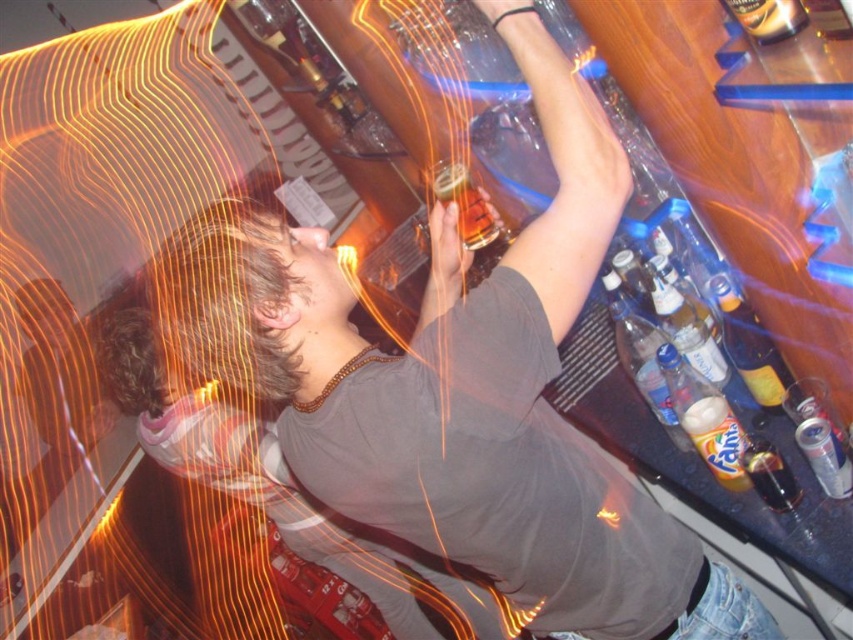
Can you confirm if clear glass bottle at center is positioned below gold metallic beer can at upper right?

Correct, clear glass bottle at center is located below gold metallic beer can at upper right.

Is clear glass bottle at center thinner than gold metallic beer can at upper right?

In fact, clear glass bottle at center might be wider than gold metallic beer can at upper right.

Looking at this image, measure the distance between clear glass bottle at center and camera.

clear glass bottle at center is 1.49 meters away from camera.

Locate an element on the screen. Image resolution: width=853 pixels, height=640 pixels. clear glass bottle at center is located at coordinates (685, 326).

Can you confirm if translucent plastic soda can at upper right is positioned to the right of gold metallic beer can at upper right?

Yes, translucent plastic soda can at upper right is to the right of gold metallic beer can at upper right.

Is translucent plastic soda can at upper right wider than gold metallic beer can at upper right?

Correct, the width of translucent plastic soda can at upper right exceeds that of gold metallic beer can at upper right.

Image resolution: width=853 pixels, height=640 pixels. Describe the element at coordinates (769, 474) in the screenshot. I see `translucent plastic soda can at upper right` at that location.

I want to click on translucent plastic soda can at upper right, so click(x=769, y=474).

Can you confirm if translucent amber glass at upper center is bigger than translucent plastic soda can at upper right?

Yes, translucent amber glass at upper center is bigger than translucent plastic soda can at upper right.

Measure the distance between translucent amber glass at upper center and translucent plastic soda can at upper right.

translucent amber glass at upper center and translucent plastic soda can at upper right are 28.14 inches apart.

Between point (457, 198) and point (782, 472), which one is positioned in front?

Positioned in front is point (782, 472).

Where is `translucent amber glass at upper center`? translucent amber glass at upper center is located at coordinates (465, 204).